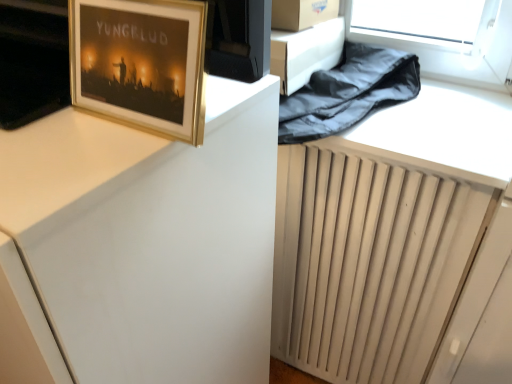
Question: In the image, is gold-framed picture at upper left on the left side or the right side of white matte computer desk at upper left?

Choices:
 (A) left
 (B) right

Answer: (B)

Question: Is gold-framed picture at upper left in front of or behind white matte computer desk at upper left in the image?

Choices:
 (A) behind
 (B) front

Answer: (A)

Question: Is gold-framed picture at upper left taller or shorter than white matte computer desk at upper left?

Choices:
 (A) short
 (B) tall

Answer: (A)

Question: Does point (115, 365) appear closer or farther from the camera than point (161, 14)?

Choices:
 (A) farther
 (B) closer

Answer: (A)

Question: Considering the positions of white matte computer desk at upper left and gold-framed picture at upper left in the image, is white matte computer desk at upper left wider or thinner than gold-framed picture at upper left?

Choices:
 (A) wide
 (B) thin

Answer: (A)

Question: From their relative heights in the image, would you say white matte computer desk at upper left is taller or shorter than gold-framed picture at upper left?

Choices:
 (A) short
 (B) tall

Answer: (B)

Question: From the image's perspective, is white matte computer desk at upper left above or below gold-framed picture at upper left?

Choices:
 (A) below
 (B) above

Answer: (A)